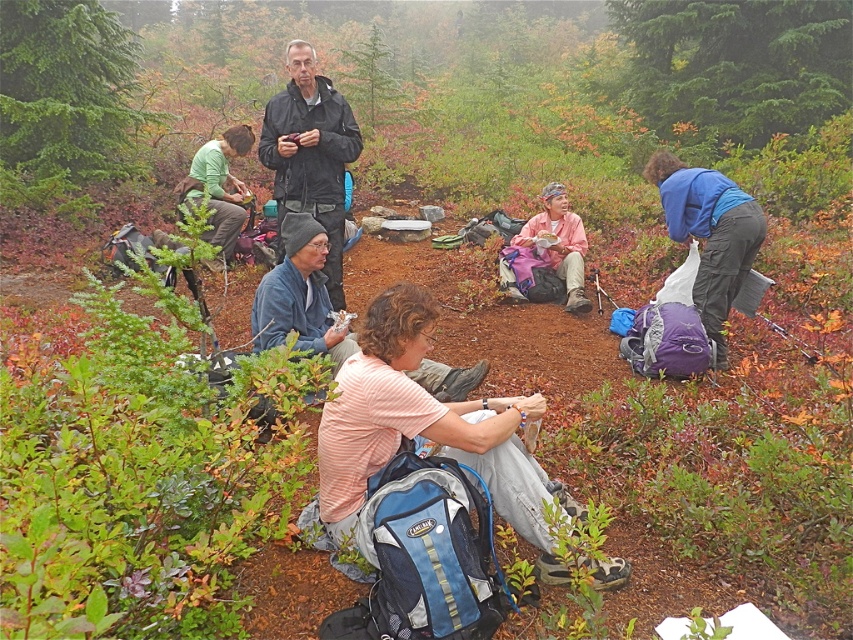
You are part of a hiking group in the forest and notice two items at the center of the scene. One is the black matte jacket at center and the other is the pink fabric at center. Which item would appear larger in your view?

The black matte jacket at center appears larger because it is closer to the viewer than the pink fabric at center.

You are standing at the origin point of the coordinate system. Where is the striped cotton shirt at center located in terms of coordinates?

The striped cotton shirt at center is located at point coordinates of (x=426, y=428).

You are a photographer trying to capture the autumn scenery in the forest. You notice the black matte jacket at center and the pink fabric at center. Which object is located to the right of the other?

The black matte jacket at center is positioned on the left side of pink fabric at center, so the pink fabric at center is to the right of the black matte jacket at center.